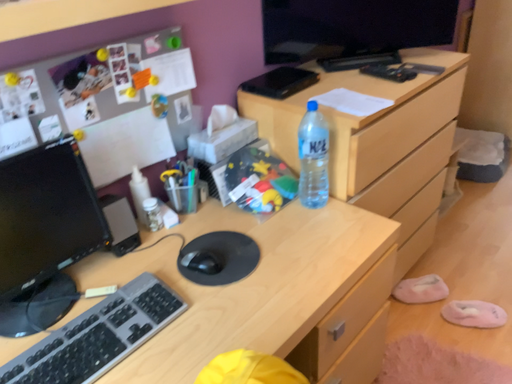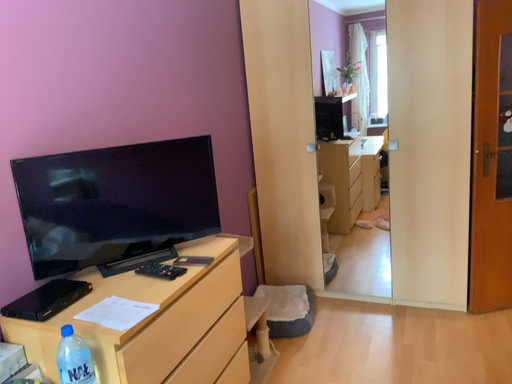
Question: Which way did the camera rotate in the video?

Choices:
 (A) rotated upward
 (B) rotated downward

Answer: (A)